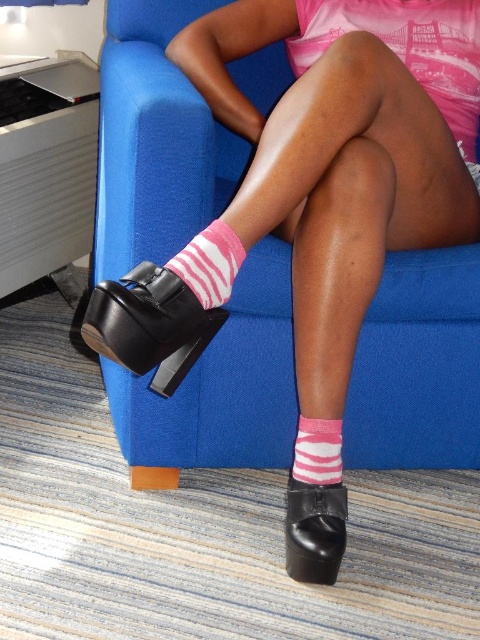
Question: Based on their relative distances, which object is farther from the pink striped sock at lower center?

Choices:
 (A) black leather shoe at lower center
 (B) pink striped sock at center
 (C) black leather shoe at lower left

Answer: (B)

Question: Which point is farther from the camera taking this photo?

Choices:
 (A) (335, 483)
 (B) (308, 572)
 (C) (192, 364)

Answer: (A)

Question: Does black leather shoe at lower center have a larger size compared to pink striped sock at center?

Choices:
 (A) no
 (B) yes

Answer: (B)

Question: Can you confirm if black leather shoe at lower left is positioned below pink striped sock at lower center?

Choices:
 (A) yes
 (B) no

Answer: (B)

Question: Can you confirm if black leather shoe at lower center is positioned below pink striped sock at center?

Choices:
 (A) yes
 (B) no

Answer: (A)

Question: Which point is closer to the camera?

Choices:
 (A) pink striped sock at lower center
 (B) black leather shoe at lower left
 (C) pink striped sock at center

Answer: (B)